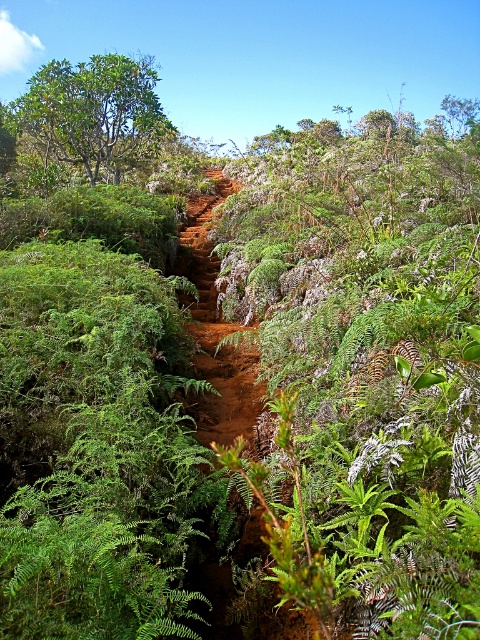
You are standing at the starting point of the hiking trail and see two points marked on the path ahead. The first point is located at coordinates point (x=214, y=317) and the second at point (x=51, y=128). Which point is closer to your current position?

Point (x=214, y=317) is closer to the camera than point (x=51, y=128), so the first point is closer to your current position.

You are a hiker standing at the start of your journey and see the brown earthy trail at center and the green leafy tree at upper left. Which direction should you head towards to follow the trail?

You should head towards the brown earthy trail at center, which is located to the right of the green leafy tree at upper left, indicating the trail is the correct path to follow.